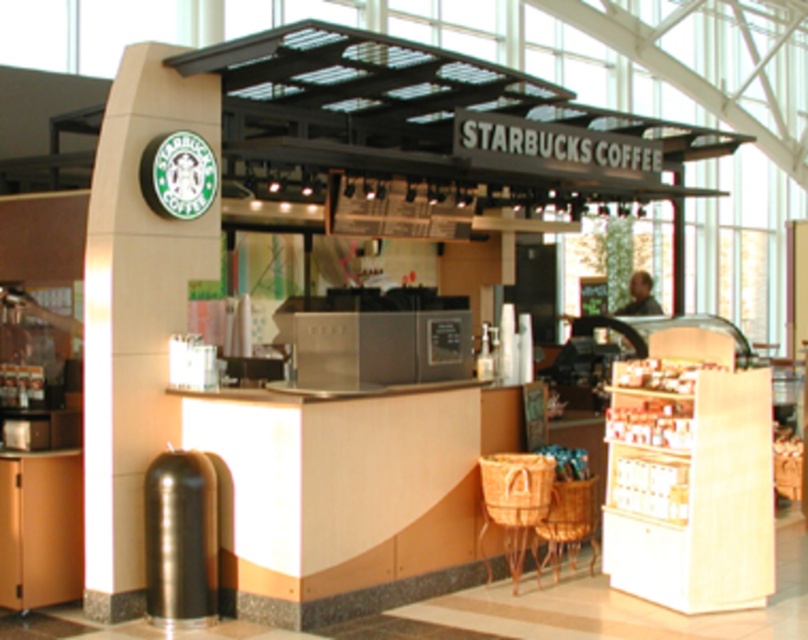
Question: From the image, what is the correct spatial relationship of metallic cylindrical trash can at left in relation to woven wood chair at lower center?

Choices:
 (A) below
 (B) above

Answer: (B)

Question: Which point is farther from the camera taking this photo?

Choices:
 (A) pos(567,492)
 (B) pos(552,480)
 (C) pos(192,125)

Answer: (A)

Question: Is metallic cylindrical trash can at left above woven wood chair at lower center?

Choices:
 (A) yes
 (B) no

Answer: (A)

Question: Based on their relative distances, which object is nearer to the metallic cylindrical trash can at left?

Choices:
 (A) woven wood chair at lower center
 (B) brown woven basket at lower right

Answer: (B)

Question: Is metallic cylindrical trash can at left below woven wood chair at lower center?

Choices:
 (A) yes
 (B) no

Answer: (B)

Question: Among these points, which one is nearest to the camera?

Choices:
 (A) (570, 492)
 (B) (550, 465)
 (C) (87, 557)

Answer: (C)